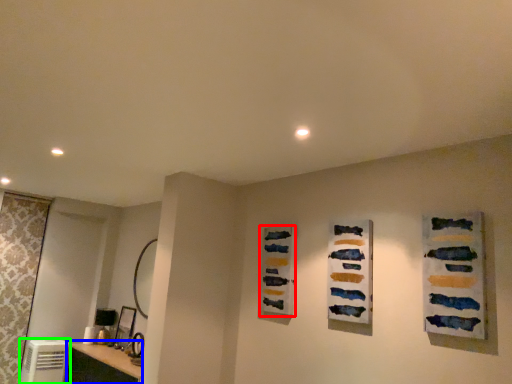
Question: Which is nearer to the art (highlighted by a red box)? vanity (highlighted by a blue box) or appliance (highlighted by a green box).

Choices:
 (A) vanity
 (B) appliance

Answer: (A)